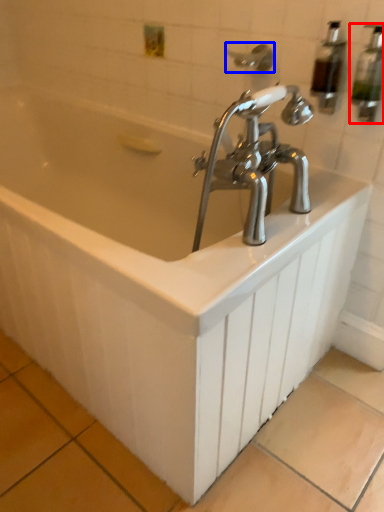
Question: Which point is closer to the camera, soap dispenser (highlighted by a red box) or shower (highlighted by a blue box)?

Choices:
 (A) soap dispenser
 (B) shower

Answer: (A)